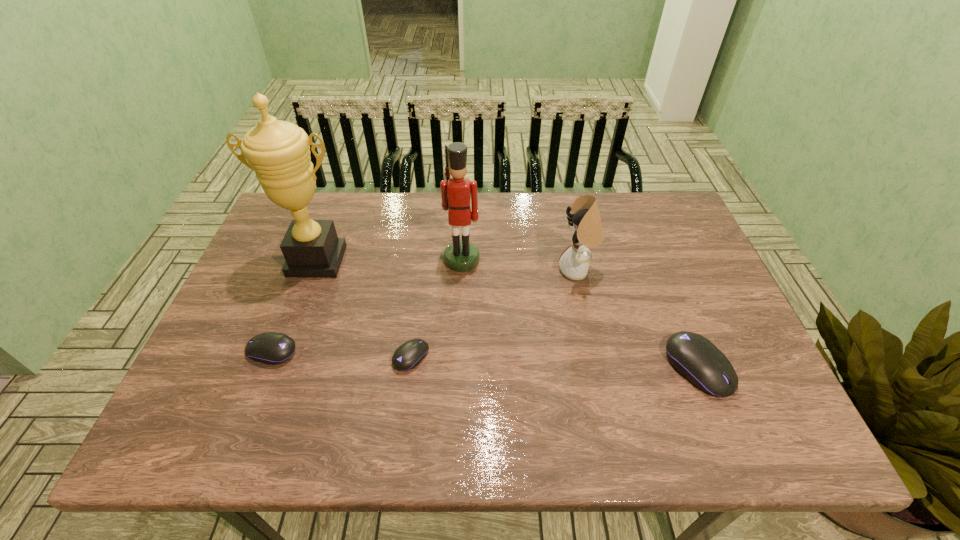
In order to click on the second tallest computer mouse in this screenshot , I will do point(270,347).

Where is `the fifth tallest object`? the fifth tallest object is located at coordinates (270, 347).

The image size is (960, 540). In order to click on the second computer mouse from right to left in this screenshot , I will do `click(407, 356)`.

You are a GUI agent. You are given a task and a screenshot of the screen. Output one action in this format:
    pyautogui.click(x=<x>, y=<y>)
    Task: Click on the shortest computer mouse
    The height and width of the screenshot is (540, 960).
    Given the screenshot: What is the action you would take?
    pyautogui.click(x=407, y=356)

Where is `the third shortest object`? the third shortest object is located at coordinates (697, 359).

You are a GUI agent. You are given a task and a screenshot of the screen. Output one action in this format:
    pyautogui.click(x=<x>, y=<y>)
    Task: Click on the rightmost object
    
    Given the screenshot: What is the action you would take?
    pyautogui.click(x=697, y=359)

I want to click on the fifth object from left to right, so pyautogui.click(x=585, y=221).

Where is `doll`? doll is located at coordinates (585, 221).

Identify the location of the fourth object from left to right. (460, 256).

This screenshot has height=540, width=960. What are the coordinates of `nutcracker` in the screenshot? It's located at (460, 256).